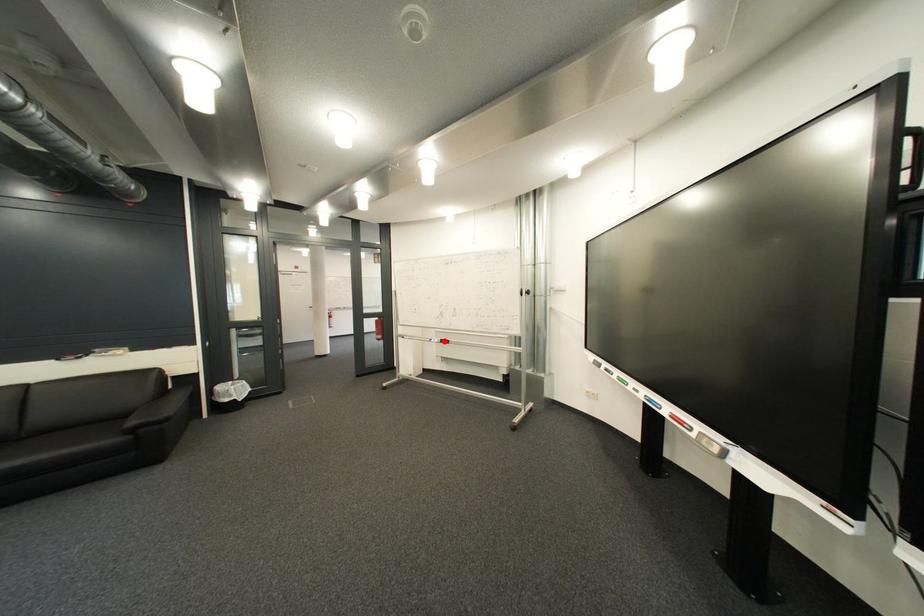
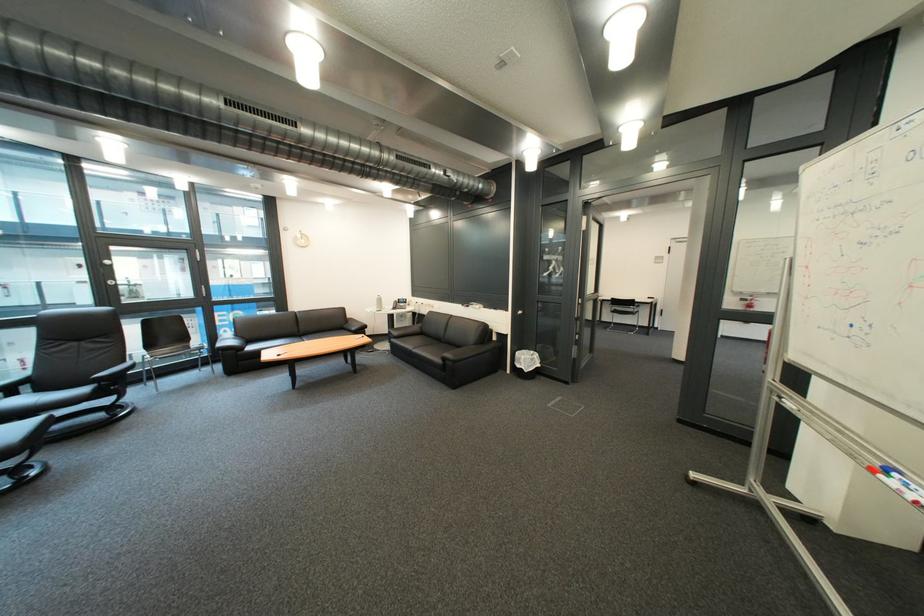
Locate, in the second image, the point that corresponds to the highlighted location in the first image.

(901, 472)